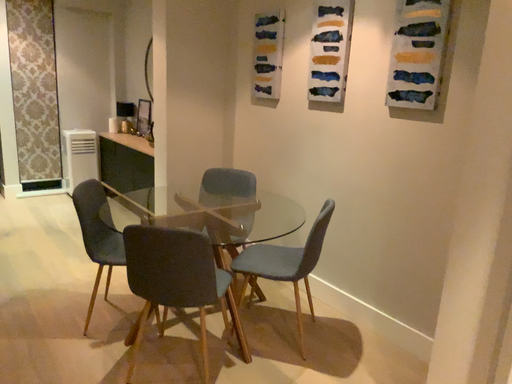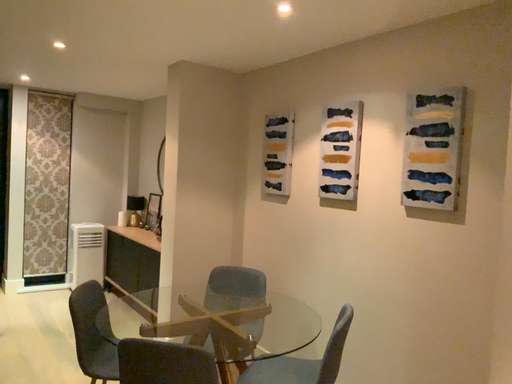
Question: How did the camera likely rotate when shooting the video?

Choices:
 (A) rotated upward
 (B) rotated downward

Answer: (A)